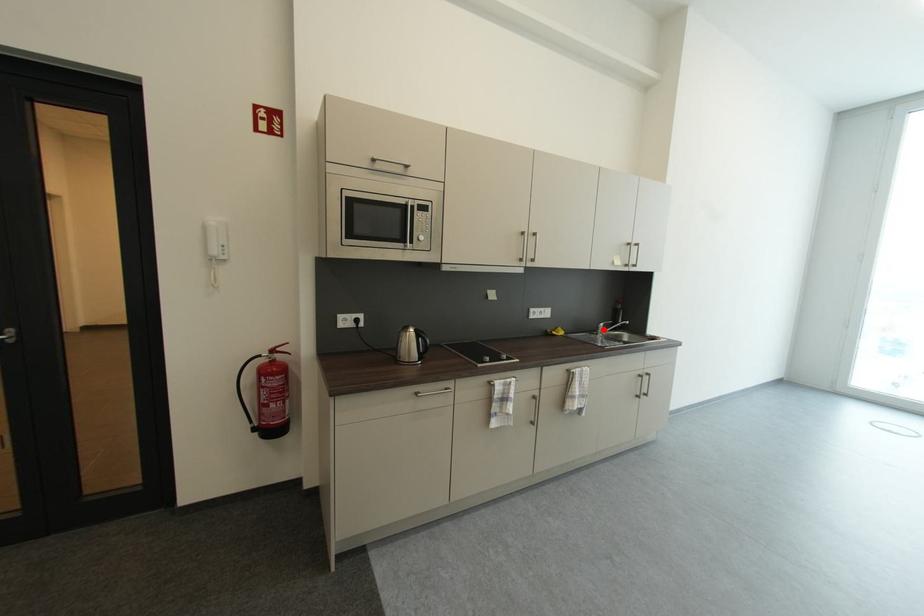
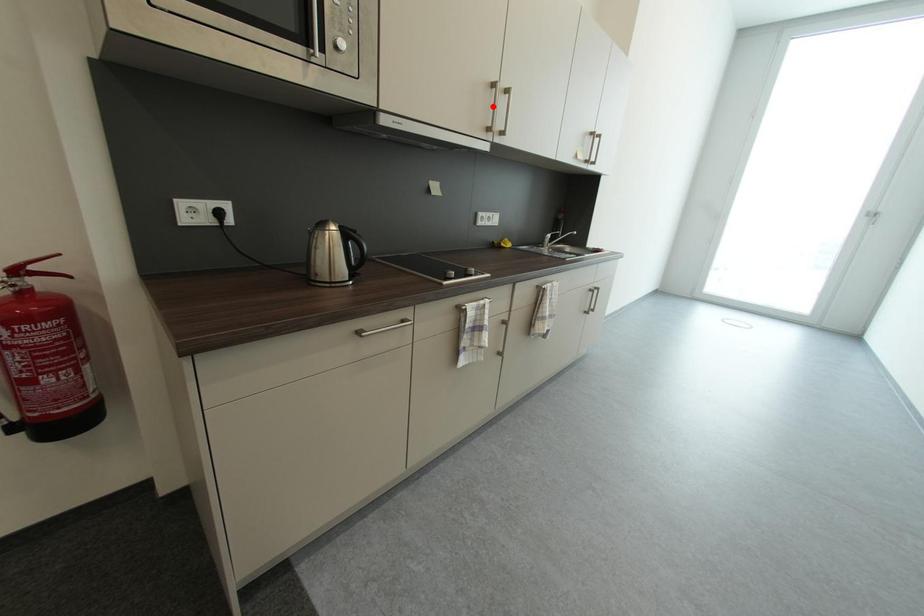
I am providing you with two images of the same scene from different viewpoints. A red point is marked on the first image and another point is marked on the second image. Are the points marked in image1 and image2 representing the same 3D position?

No